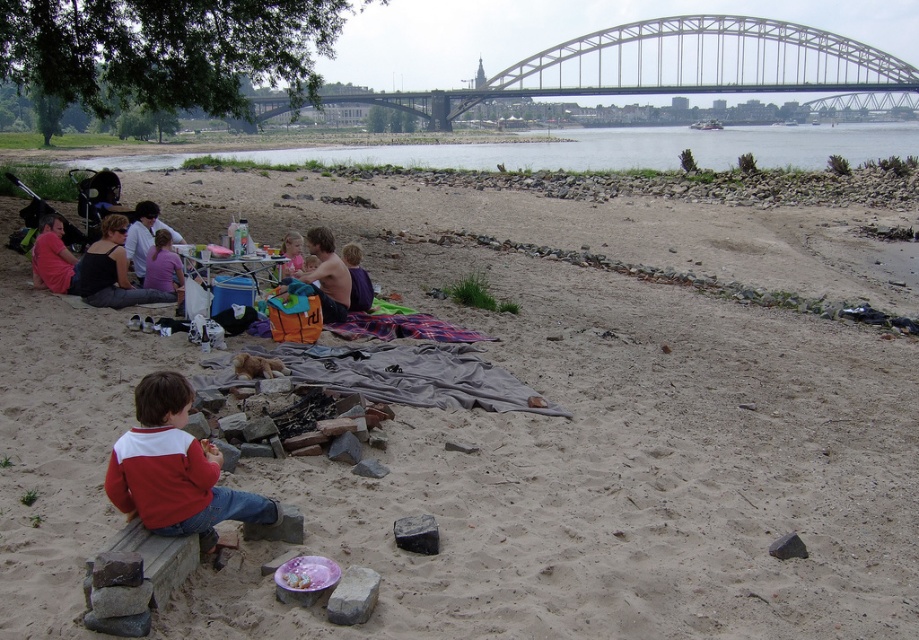
Looking at this image, you are a hiker who has just arrived at the riverside picnic area and need to find your shiny orange bag at center. According to the map coordinates provided, where should you look to locate it?

The shiny orange bag at center is located at point (327, 275) on the map.

You are standing at the picnic area and want to take a photo that includes both the point at coordinates point(745,36) and point(187,532). Which point should you position closer to the camera to ensure both are in the frame?

Since point(745,36) is further from the camera than point(187,532), you should position yourself closer to the camera to include both points in the frame.

You are a photographer standing at the picnic blanket. You want to capture a photo that includes both the metallic gray bridge at upper center and the red cotton sweater at lower left. Given their distance apart, will they both fit in your camera frame if your camera has a 50mm lens? Assume the camera sensor size is 24x36mm and the subject distance is 10 meters.

The metallic gray bridge at upper center and red cotton sweater at lower left are 52.44 meters apart. With a 50mm lens on a full frame sensor, the field of view at 10 meters would be approximately 5.5 meters wide. Since the distance between the two objects is much larger than the field of view, they cannot both fit in the frame.